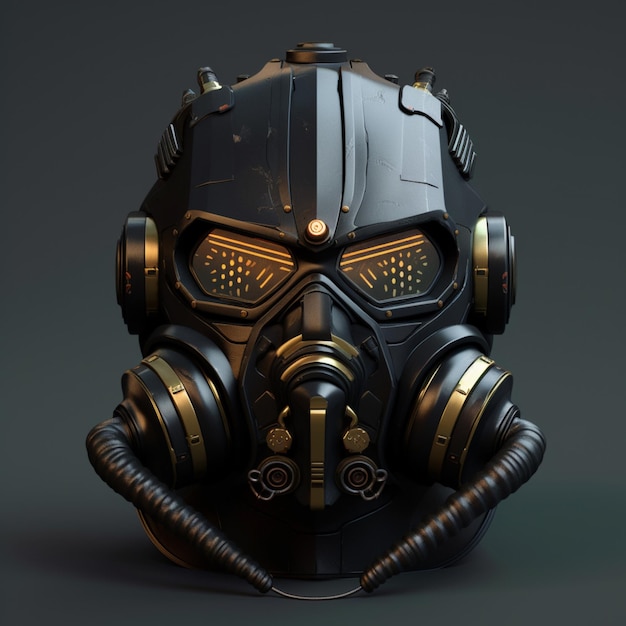
The height and width of the screenshot is (626, 626). I want to click on left side air filter, so click(162, 408).